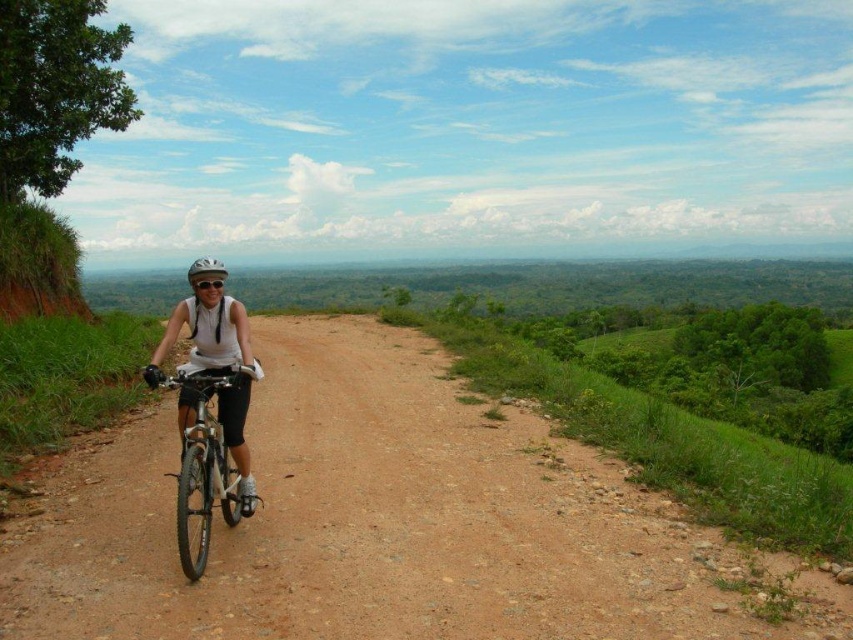
Question: Which of these objects is positioned closest to the brown gravel dirt track at center?

Choices:
 (A) white matte helmet at center
 (B) silver metallic bicycle at center-left
 (C) white matte bicycle helmet at center

Answer: (B)

Question: Estimate the real-world distances between objects in this image. Which object is farther from the silver metallic bicycle at center-left?

Choices:
 (A) white matte helmet at center
 (B) brown gravel dirt track at center

Answer: (B)

Question: Does white matte helmet at center have a greater width compared to silver metallic bicycle at center-left?

Choices:
 (A) no
 (B) yes

Answer: (B)

Question: Does brown gravel dirt track at center appear on the right side of silver metallic bicycle at center-left?

Choices:
 (A) no
 (B) yes

Answer: (B)

Question: Which of the following is the closest to the observer?

Choices:
 (A) silver metallic bicycle at center-left
 (B) white matte bicycle helmet at center

Answer: (A)

Question: Considering the relative positions of white matte helmet at center and silver metallic bicycle at center-left in the image provided, where is white matte helmet at center located with respect to silver metallic bicycle at center-left?

Choices:
 (A) below
 (B) above

Answer: (B)